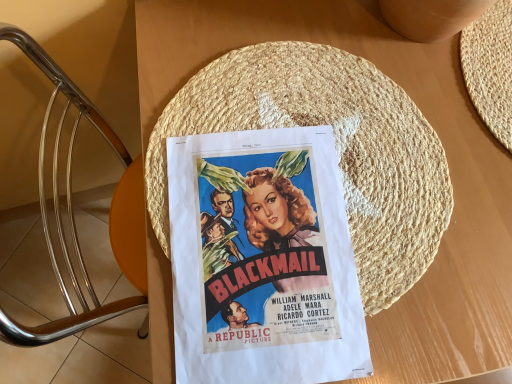
Where is `vacant region above matte paper poster at center (from a real-world perspective)`? vacant region above matte paper poster at center (from a real-world perspective) is located at coordinates (265, 249).